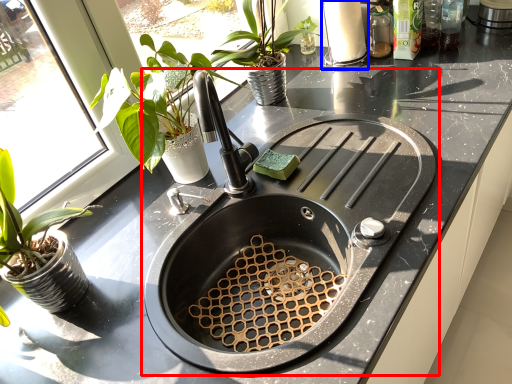
Question: Which object is further to the camera taking this photo, sink (highlighted by a red box) or appliance (highlighted by a blue box)?

Choices:
 (A) sink
 (B) appliance

Answer: (B)